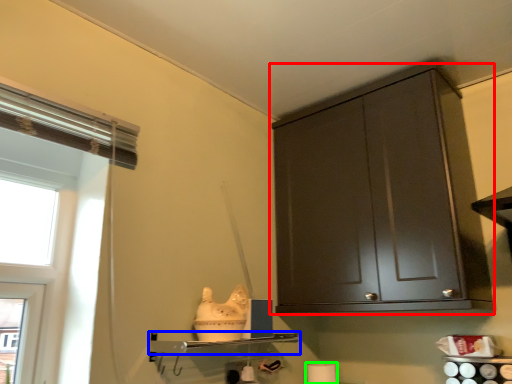
Question: Estimate the real-world distances between objects in this image. Which object is closer to cabinetry (highlighted by a red box), shelf (highlighted by a blue box) or toilet paper (highlighted by a green box)?

Choices:
 (A) shelf
 (B) toilet paper

Answer: (A)